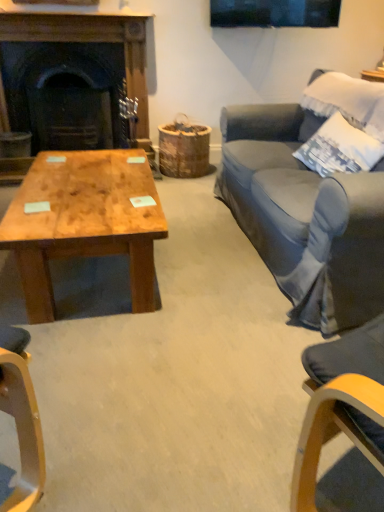
Question: Does dark wood fireplace at left appear on the left side of natural wood coffee table at lower left?

Choices:
 (A) no
 (B) yes

Answer: (B)

Question: Does dark wood fireplace at left appear on the right side of natural wood coffee table at lower left?

Choices:
 (A) no
 (B) yes

Answer: (A)

Question: Does dark wood fireplace at left come in front of natural wood coffee table at lower left?

Choices:
 (A) no
 (B) yes

Answer: (A)

Question: Is dark wood fireplace at left positioned with its back to natural wood coffee table at lower left?

Choices:
 (A) yes
 (B) no

Answer: (B)

Question: From the image's perspective, is dark wood fireplace at left on natural wood coffee table at lower left?

Choices:
 (A) no
 (B) yes

Answer: (B)

Question: Considering the relative sizes of dark wood fireplace at left and natural wood coffee table at lower left in the image provided, is dark wood fireplace at left shorter than natural wood coffee table at lower left?

Choices:
 (A) no
 (B) yes

Answer: (A)

Question: Is white cotton pillow at upper right far away from natural wood coffee table at lower left?

Choices:
 (A) yes
 (B) no

Answer: (A)

Question: Is the position of white cotton pillow at upper right less distant than that of natural wood coffee table at lower left?

Choices:
 (A) yes
 (B) no

Answer: (B)

Question: Is white cotton pillow at upper right to the right of natural wood coffee table at lower left from the viewer's perspective?

Choices:
 (A) no
 (B) yes

Answer: (B)

Question: Does white cotton pillow at upper right have a lesser height compared to natural wood coffee table at lower left?

Choices:
 (A) yes
 (B) no

Answer: (B)

Question: Is white cotton pillow at upper right facing towards natural wood coffee table at lower left?

Choices:
 (A) no
 (B) yes

Answer: (B)

Question: Is white cotton pillow at upper right thinner than natural wood coffee table at lower left?

Choices:
 (A) no
 (B) yes

Answer: (B)

Question: Does dark wood fireplace at left contain white cotton pillow at upper right?

Choices:
 (A) no
 (B) yes

Answer: (A)